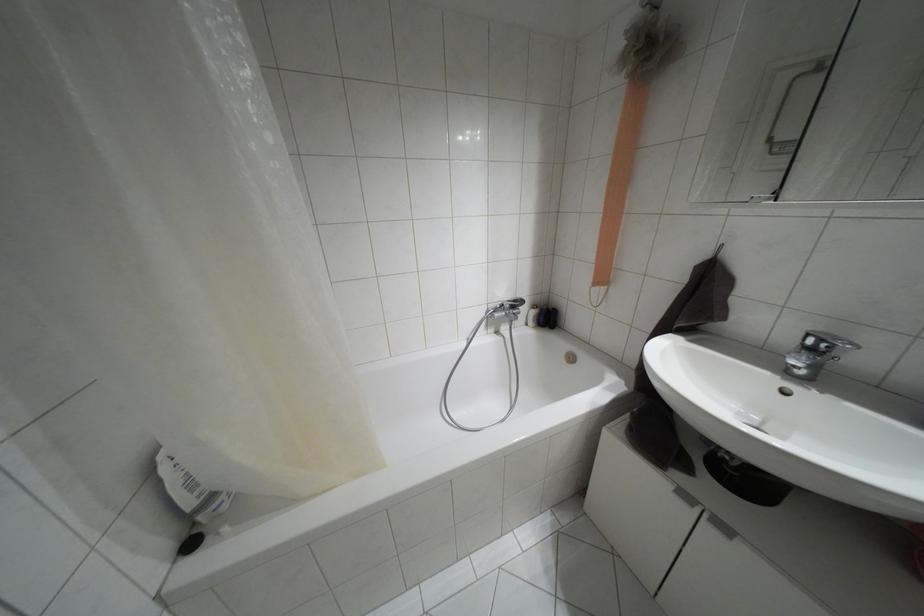
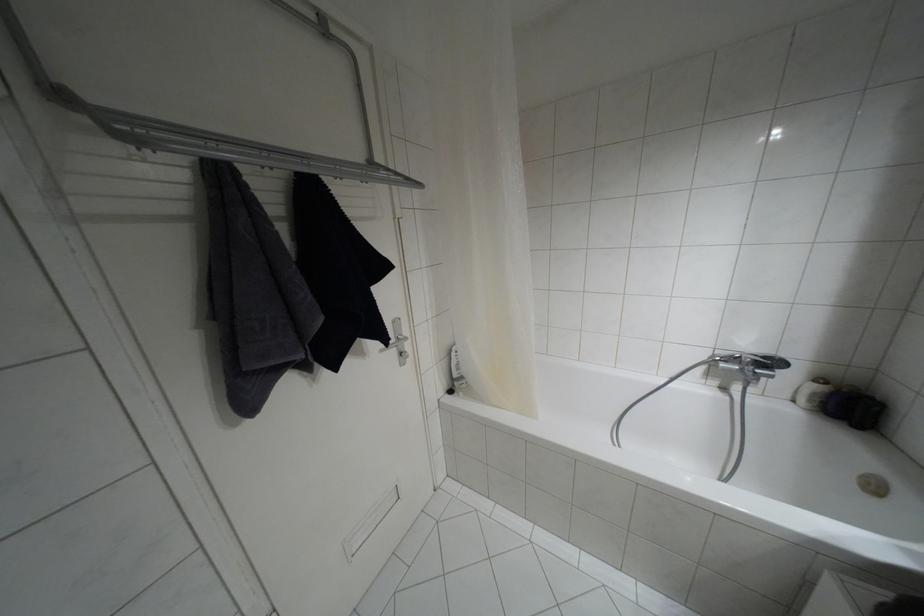
In the second image, find the point that corresponds to (514,301) in the first image.

(763, 357)